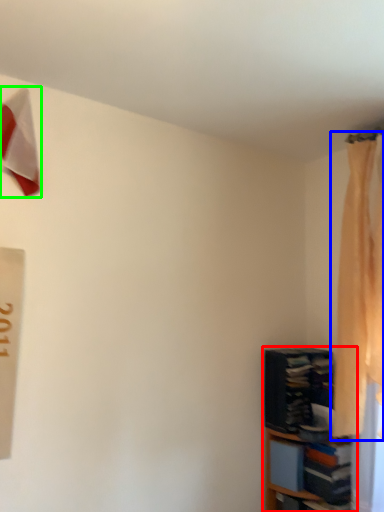
Question: Which object is positioned farthest from shelf (highlighted by a red box)? Select from curtain (highlighted by a blue box) and twin (highlighted by a green box).

Choices:
 (A) curtain
 (B) twin

Answer: (B)